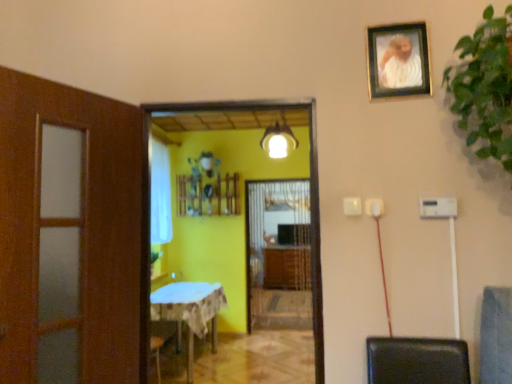
What is the approximate height of wooden cabinet at center?

It is 34.56 inches.

Where is `wooden cabinet at center`? This screenshot has height=384, width=512. wooden cabinet at center is located at coordinates (287, 268).

Locate an element on the screen. white sheer curtain at left is located at coordinates (160, 193).

The image size is (512, 384). Describe the element at coordinates (278, 254) in the screenshot. I see `wooden screen door at center, which appears as the 2th screen door when viewed from the front` at that location.

This screenshot has width=512, height=384. I want to click on yellow matte screen door at center, which appears as the 2th screen door when viewed from the back, so click(x=311, y=192).

In order to face green leafy plant at upper right, should I rotate leftwards or rightwards?

To align with it, rotate right about 28.940°.

I want to click on white glossy light fixture at center, so click(278, 141).

Is wooden screen door at center, which appears as the 2th screen door when viewed from the front, outside of white glossy light fixture at center?

Indeed, wooden screen door at center, which appears as the 2th screen door when viewed from the front, is completely outside white glossy light fixture at center.

Is wooden screen door at center, which appears as the 2th screen door when viewed from the front, looking in the opposite direction of white glossy light fixture at center?

No, wooden screen door at center, which appears as the 2th screen door when viewed from the front, is not facing away from white glossy light fixture at center.

From a real-world perspective, which object stands above the other?

white glossy light fixture at center is physically above.

From a real-world perspective, is yellow matte screen door at center, positioned as the first screen door in front-to-back order, physically located above or below green leafy plant at upper right?

In terms of real-world spatial position, yellow matte screen door at center, positioned as the first screen door in front-to-back order, is below green leafy plant at upper right.

Is yellow matte screen door at center, which appears as the 2th screen door when viewed from the back, spatially inside green leafy plant at upper right, or outside of it?

yellow matte screen door at center, which appears as the 2th screen door when viewed from the back, lies outside green leafy plant at upper right.

Based on the photo, can you confirm if yellow matte screen door at center, which appears as the 2th screen door when viewed from the back, is taller than green leafy plant at upper right?

Yes.

Between gold-framed photo at upper right and wooden cabinet at center, which one is positioned behind?

wooden cabinet at center.

From a real-world perspective, is gold-framed photo at upper right over wooden cabinet at center?

Yes, from a real-world perspective, gold-framed photo at upper right is over wooden cabinet at center

Is gold-framed photo at upper right aimed at wooden cabinet at center?

No, gold-framed photo at upper right is not aimed at wooden cabinet at center.

Considering the points (408, 88) and (283, 287), which point is behind, point (408, 88) or point (283, 287)?

Point (283, 287)

Is gold-framed photo at upper right aimed at blue cloth-covered table at center?

No.

Does gold-framed photo at upper right appear on the left side of blue cloth-covered table at center?

In fact, gold-framed photo at upper right is to the right of blue cloth-covered table at center.

In the scene shown: From the image's perspective, between gold-framed photo at upper right and blue cloth-covered table at center, who is located below?

blue cloth-covered table at center appears lower in the image.

Is gold-framed photo at upper right touching blue cloth-covered table at center?

There is a gap between gold-framed photo at upper right and blue cloth-covered table at center.

What's the angular difference between white glossy light fixture at center and white sheer curtain at left's facing directions?

The angular difference between white glossy light fixture at center and white sheer curtain at left is 86.2 degrees.

Considering the points (285, 135) and (165, 181), which point is in front, point (285, 135) or point (165, 181)?

The point (285, 135) is closer.

Is white glossy light fixture at center located outside white sheer curtain at left?

Yes, white glossy light fixture at center is outside of white sheer curtain at left.

From the image's perspective, which is below, white glossy light fixture at center or white sheer curtain at left?

white sheer curtain at left.

Based on the photo, from the image's perspective, is gold-framed photo at upper right on yellow matte screen door at center, which appears as the 2th screen door when viewed from the back?

Yes.

From a real-world perspective, is gold-framed photo at upper right physically located above or below yellow matte screen door at center, positioned as the first screen door in front-to-back order?

Clearly, from a real-world perspective, gold-framed photo at upper right is above yellow matte screen door at center, positioned as the first screen door in front-to-back order.

Is gold-framed photo at upper right situated inside yellow matte screen door at center, which appears as the 2th screen door when viewed from the back, or outside?

gold-framed photo at upper right is not enclosed by yellow matte screen door at center, which appears as the 2th screen door when viewed from the back.

Between gold-framed photo at upper right and yellow matte screen door at center, positioned as the first screen door in front-to-back order, which one appears on the right side from the viewer's perspective?

From the viewer's perspective, gold-framed photo at upper right appears more on the right side.

Does white sheer curtain at left have a greater height compared to wooden cabinet at center?

Indeed, white sheer curtain at left has a greater height compared to wooden cabinet at center.

Could wooden cabinet at center be considered to be inside white sheer curtain at left?

Actually, wooden cabinet at center is outside white sheer curtain at left.

Does white sheer curtain at left have a greater width compared to wooden cabinet at center?

No.

The image size is (512, 384). In order to click on light fixture above the wooden screen door at center, which appears as the 2th screen door when viewed from the front (from the image's perspective) in this screenshot , I will do `click(278, 141)`.

From the green leafy plant at upper right, count 1st screen doors backward and point to it. Please provide its 2D coordinates.

[(311, 192)]

Estimate the real-world distances between objects in this image. Which object is closer to yellow matte screen door at center, positioned as the first screen door in front-to-back order, white sheer curtain at left or wooden cabinet at center?

white sheer curtain at left lies closer to yellow matte screen door at center, positioned as the first screen door in front-to-back order, than the other object.

When comparing their distances from wooden cabinet at center, does white sheer curtain at left or blue cloth-covered table at center seem further?

Based on the image, blue cloth-covered table at center appears to be further to wooden cabinet at center.

Based on their spatial positions, is yellow matte screen door at center, which appears as the 2th screen door when viewed from the back, or wooden cabinet at center closer to blue cloth-covered table at center?

yellow matte screen door at center, which appears as the 2th screen door when viewed from the back, is positioned closer to the anchor blue cloth-covered table at center.

When comparing their distances from wooden screen door at center, the 1th screen door viewed from the back, does gold-framed photo at upper right or white glossy light fixture at center seem further?

gold-framed photo at upper right lies further to wooden screen door at center, the 1th screen door viewed from the back, than the other object.

Considering their positions, is gold-framed photo at upper right positioned closer to wooden cabinet at center than green leafy plant at upper right?

Based on the image, gold-framed photo at upper right appears to be nearer to wooden cabinet at center.

Which object lies further to the anchor point wooden screen door at center, the 1th screen door viewed from the back, gold-framed photo at upper right or wooden cabinet at center?

The object further to wooden screen door at center, the 1th screen door viewed from the back, is gold-framed photo at upper right.

When comparing their distances from gold-framed photo at upper right, does green leafy plant at upper right or blue cloth-covered table at center seem closer?

Based on the image, green leafy plant at upper right appears to be nearer to gold-framed photo at upper right.

From the image, which object appears to be farther from yellow matte screen door at center, which appears as the 2th screen door when viewed from the back, wooden cabinet at center or gold-framed photo at upper right?

wooden cabinet at center lies further to yellow matte screen door at center, which appears as the 2th screen door when viewed from the back, than the other object.

You are a GUI agent. You are given a task and a screenshot of the screen. Output one action in this format:
    pyautogui.click(x=<x>, y=<y>)
    Task: Click on the curtain between yellow matte screen door at center, positioned as the first screen door in front-to-back order, and wooden screen door at center, the 1th screen door viewed from the back, from front to back
    This screenshot has width=512, height=384.
    Given the screenshot: What is the action you would take?
    (160, 193)

The width and height of the screenshot is (512, 384). What are the coordinates of `table located between white glossy light fixture at center and wooden screen door at center, the 1th screen door viewed from the back, in the depth direction` in the screenshot? It's located at (189, 312).

Where is `curtain between blue cloth-covered table at center and wooden cabinet at center in the front-back direction`? The width and height of the screenshot is (512, 384). curtain between blue cloth-covered table at center and wooden cabinet at center in the front-back direction is located at coordinates (160, 193).

At what (x,y) coordinates should I click in order to perform the action: click on screen door positioned between gold-framed photo at upper right and wooden screen door at center, the 1th screen door viewed from the back, from near to far. Please return your answer as a coordinate pair (x, y). Looking at the image, I should click on (311, 192).